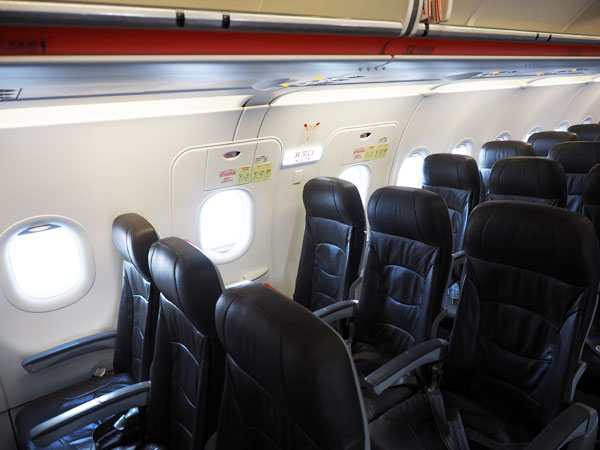
Where is `windows`? windows is located at coordinates (589, 119), (565, 128), (535, 131), (501, 136), (464, 148), (412, 169), (357, 177), (223, 212), (41, 263).